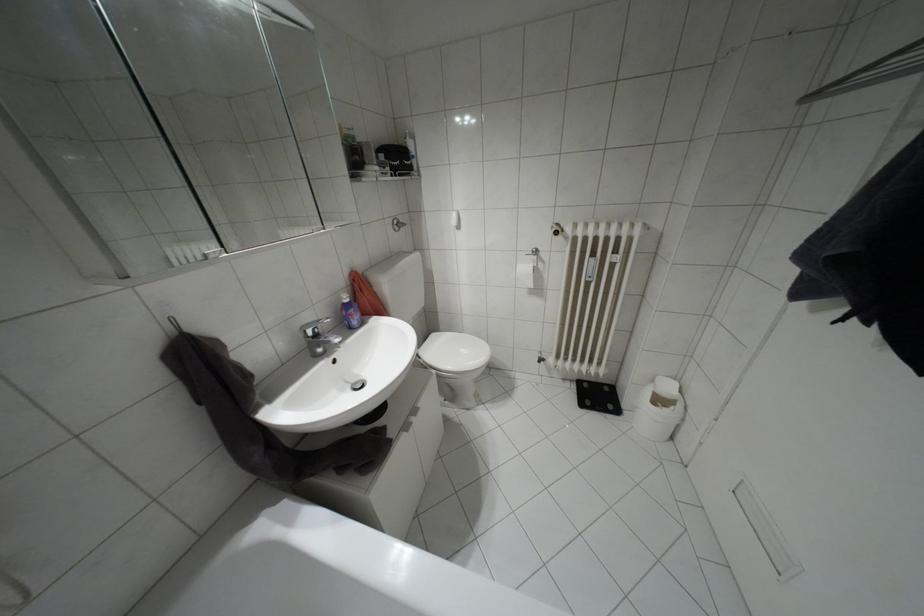
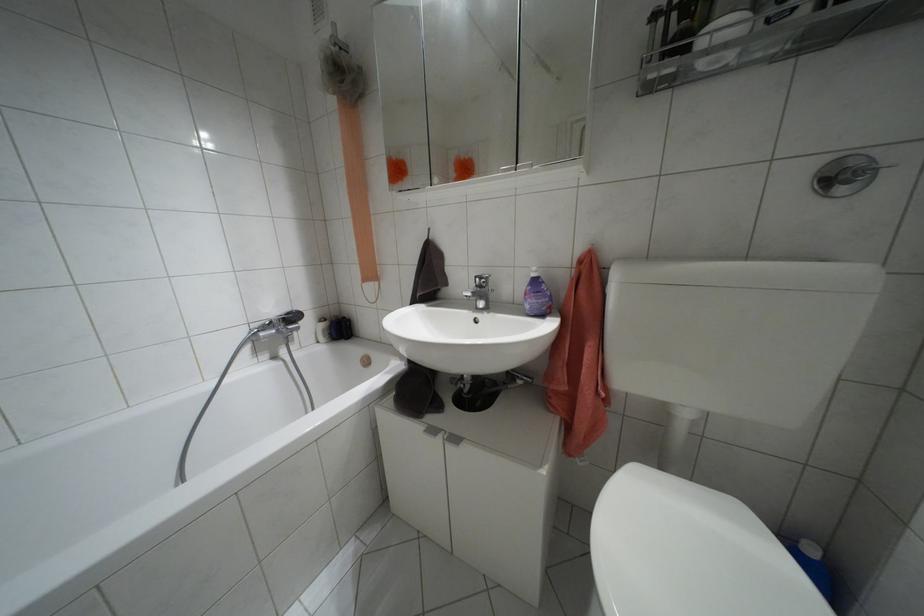
Where in the second image is the point corresponding to the point at 315,334 from the first image?

(479, 286)